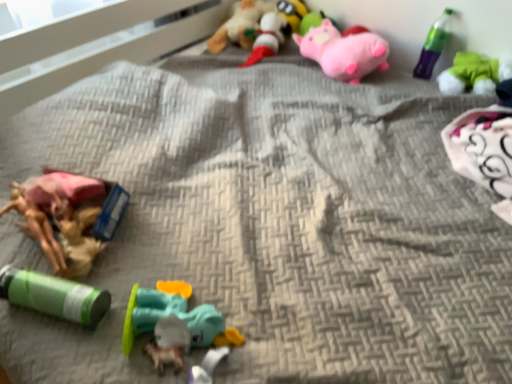
Question: Is pink plush pig at upper right, the 3th toy positioned from the top, completely or partially inside green plastic bottle at upper right?

Choices:
 (A) no
 (B) yes

Answer: (A)

Question: Is green plastic bottle at upper right wider than pink plush pig at upper right, the 3th toy positioned from the top?

Choices:
 (A) yes
 (B) no

Answer: (B)

Question: Does green plastic bottle at upper right have a larger size compared to pink plush pig at upper right, the 3th toy positioned from the top?

Choices:
 (A) no
 (B) yes

Answer: (A)

Question: Would you say green plastic bottle at upper right is outside pink plush pig at upper right, positioned as the 6th toy in bottom-to-top order?

Choices:
 (A) no
 (B) yes

Answer: (B)

Question: Is green plastic bottle at upper right looking in the opposite direction of pink plush pig at upper right, positioned as the 6th toy in bottom-to-top order?

Choices:
 (A) no
 (B) yes

Answer: (A)

Question: Considering the positions of green plush toy at upper right, the fifth toy ordered from the bottom, and pink plush pig at upper right, positioned as the 6th toy in bottom-to-top order, in the image, is green plush toy at upper right, the fifth toy ordered from the bottom, taller or shorter than pink plush pig at upper right, positioned as the 6th toy in bottom-to-top order,?

Choices:
 (A) tall
 (B) short

Answer: (B)

Question: Is green plush toy at upper right, placed as the 4th toy when sorted from top to bottom, inside the boundaries of pink plush pig at upper right, positioned as the 6th toy in bottom-to-top order, or outside?

Choices:
 (A) inside
 (B) outside

Answer: (B)

Question: Is green plush toy at upper right, placed as the 4th toy when sorted from top to bottom, to the left or to the right of pink plush pig at upper right, the 3th toy positioned from the top, in the image?

Choices:
 (A) left
 (B) right

Answer: (B)

Question: Is green plush toy at upper right, placed as the 4th toy when sorted from top to bottom, wider or thinner than pink plush pig at upper right, positioned as the 6th toy in bottom-to-top order?

Choices:
 (A) wide
 (B) thin

Answer: (B)

Question: From the image's perspective, relative to soft plush toy at upper center, the 7th toy positioned from the bottom, is rubberized plastic toy at center, which appears as the 2th toy when ordered from the bottom, above or below?

Choices:
 (A) below
 (B) above

Answer: (A)

Question: In terms of width, does rubberized plastic toy at center, which appears as the 2th toy when ordered from the bottom, look wider or thinner when compared to soft plush toy at upper center, which is counted as the 2th toy, starting from the top?

Choices:
 (A) wide
 (B) thin

Answer: (B)

Question: Is point (156, 345) positioned closer to the camera than point (238, 21)?

Choices:
 (A) farther
 (B) closer

Answer: (B)

Question: Is rubberized plastic toy at center, which is the 7th toy in top-to-bottom order, bigger or smaller than soft plush toy at upper center, the 7th toy positioned from the bottom?

Choices:
 (A) small
 (B) big

Answer: (A)

Question: From a real-world perspective, relative to soft plush toy at upper center, the 7th toy positioned from the bottom, is translucent plastic toy at center, positioned as the first toy in bottom-to-top order, vertically above or below?

Choices:
 (A) above
 (B) below

Answer: (B)

Question: Is translucent plastic toy at center, positioned as the first toy in bottom-to-top order, taller or shorter than soft plush toy at upper center, the 7th toy positioned from the bottom?

Choices:
 (A) tall
 (B) short

Answer: (B)